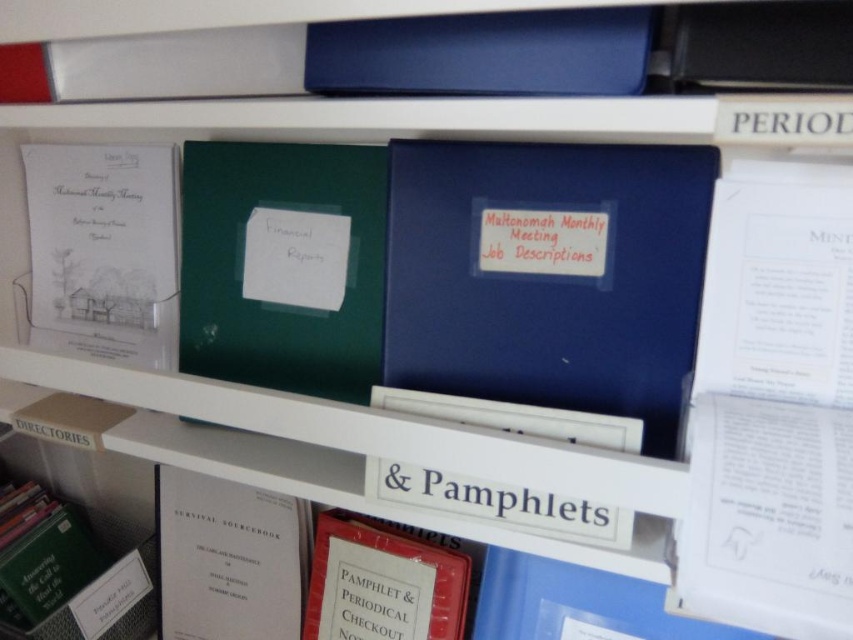
You are an office worker who needs to file a document. You see the green matte folder at center and the white paper at center. Which one is taller?

The green matte folder at center is much taller than the white paper at center.

You are organizing documents in a shelving unit and need to place a new binder labeled with the current month. The shelving unit has a top shelf with two binders and a white paper book at center. Where should you place the new binder so it aligns with the existing arrangement?

The white paper book at center is located at point (228, 557), so you should place the new binder near that coordinate to maintain alignment with the existing items.